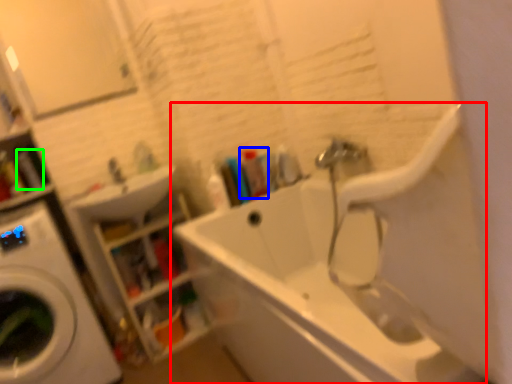
Question: Based on their relative distances, which object is nearer to bathtub (highlighted by a red box)? Choose from toiletry (highlighted by a blue box) and toiletry (highlighted by a green box).

Choices:
 (A) toiletry
 (B) toiletry

Answer: (A)